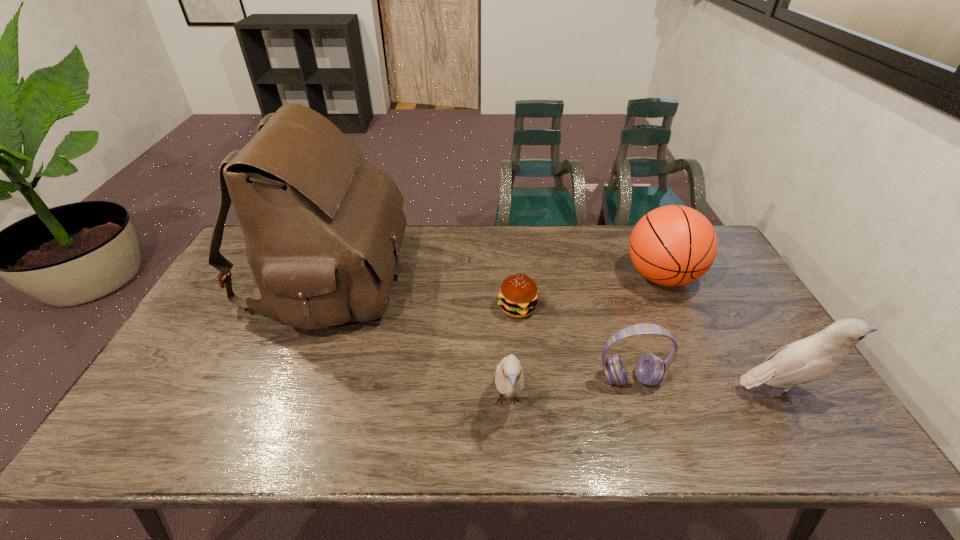
Locate an element on the screen. the left bird is located at coordinates (509, 379).

The width and height of the screenshot is (960, 540). Find the location of `the right bird`. the right bird is located at coordinates (814, 357).

I want to click on the leftmost object, so click(x=323, y=226).

Identify the location of satchel. This screenshot has height=540, width=960. (323, 226).

Where is `basketball`? The image size is (960, 540). basketball is located at coordinates (674, 245).

Where is `hamburger`? This screenshot has height=540, width=960. hamburger is located at coordinates (518, 295).

Find the location of `headset`. headset is located at coordinates (650, 369).

This screenshot has height=540, width=960. In order to click on vacant space situated on the front flap of the satchel in this screenshot , I will do `click(471, 277)`.

This screenshot has height=540, width=960. In order to click on vacant space located 0.120m on the back of the basketball in this screenshot , I will do `click(640, 233)`.

Image resolution: width=960 pixels, height=540 pixels. Identify the location of vacant area situated 0.080m on the back of the shortest object. (515, 276).